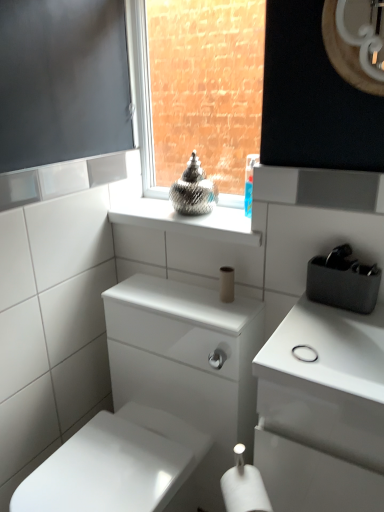
Where is `free point in front of white matte toilet paper at center, the first toilet paper from the back`? This screenshot has height=512, width=384. free point in front of white matte toilet paper at center, the first toilet paper from the back is located at coordinates (223, 314).